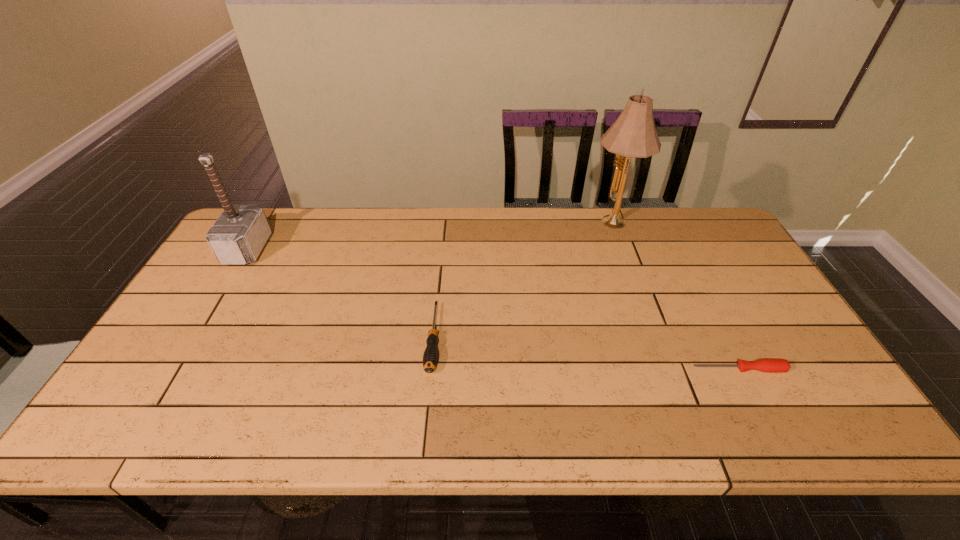
At what (x,y) coordinates should I click in order to perform the action: click on free area in between the shorter screwdriver and the left screwdriver. Please return your answer as a coordinate pair (x, y). Looking at the image, I should click on coord(587,354).

Where is `vacant area that lies between the leftmost object and the lampshade`? The height and width of the screenshot is (540, 960). vacant area that lies between the leftmost object and the lampshade is located at coordinates (429, 237).

What are the coordinates of `vacant point located between the right screwdriver and the hammer` in the screenshot? It's located at (493, 309).

This screenshot has height=540, width=960. I want to click on object that stands as the second closest to the shorter screwdriver, so click(430, 357).

The width and height of the screenshot is (960, 540). In order to click on object that is the third closest one to the third shortest object in this screenshot , I will do `click(763, 365)`.

Find the location of `free point that satisfies the following two spatial constraints: 1. on the back side of the taller screwdriver; 2. on the left side of the tallest object`. free point that satisfies the following two spatial constraints: 1. on the back side of the taller screwdriver; 2. on the left side of the tallest object is located at coordinates (444, 224).

The image size is (960, 540). Find the location of `free space that satisfies the following two spatial constraints: 1. for striking with the head of the hammer; 2. on the back side of the third tallest object`. free space that satisfies the following two spatial constraints: 1. for striking with the head of the hammer; 2. on the back side of the third tallest object is located at coordinates (194, 338).

The image size is (960, 540). In order to click on vacant area that satisfies the following two spatial constraints: 1. for striking with the head of the hammer; 2. on the right side of the taller screwdriver in this screenshot , I will do `click(194, 338)`.